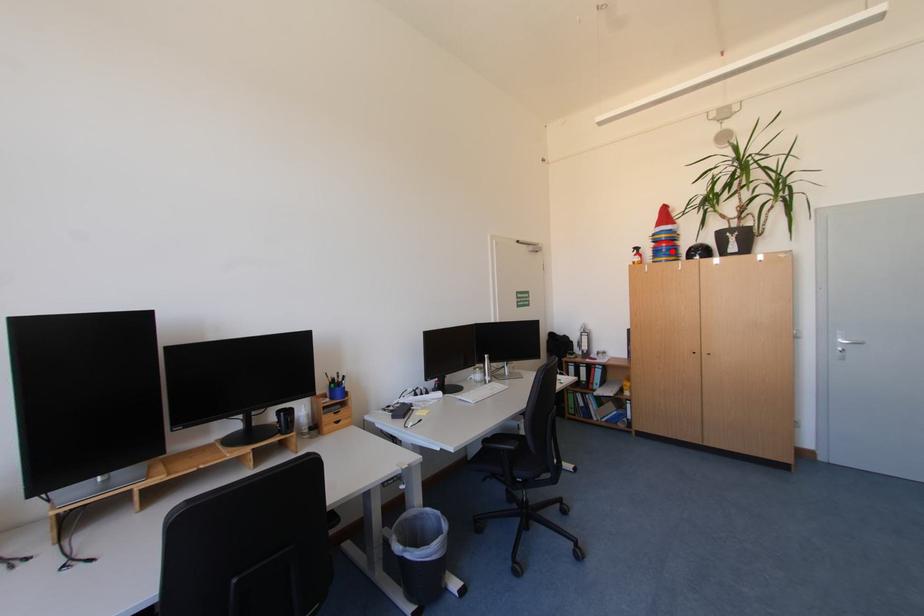
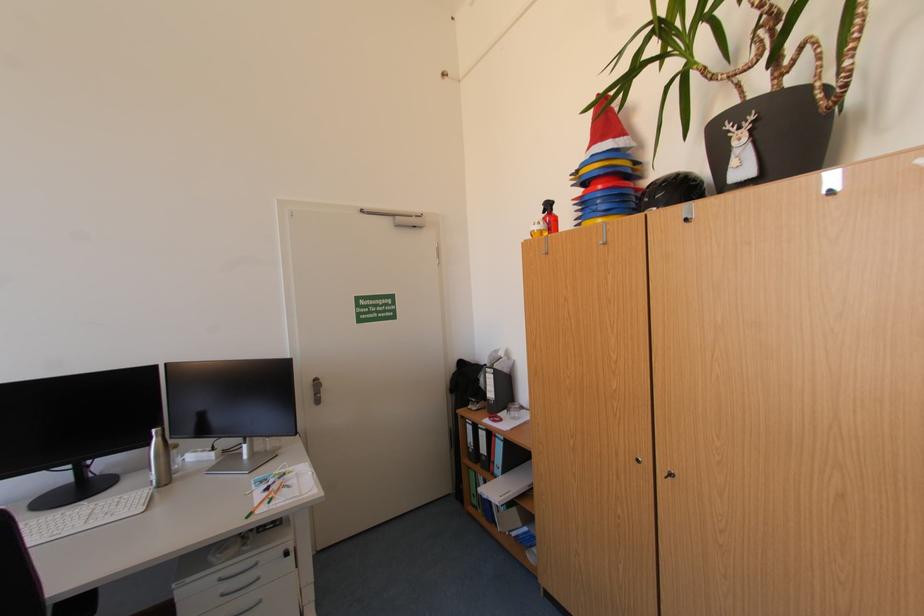
In the second image, find the point that corresponds to the highlighted location in the first image.

(606, 203)